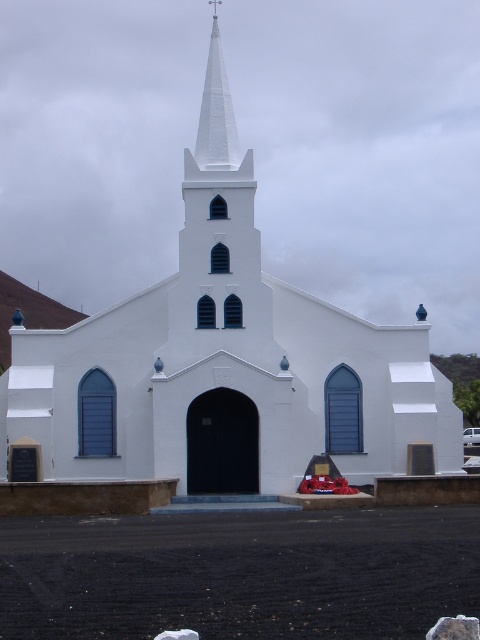
You are standing in front of the church and see a point marked at coordinates (455,628). What object is located at that point?

The point at coordinates (455,628) marks a smooth gray rock at lower right.

You are a photographer standing in front of the church. You want to take a photo of the white matte van at center without the white smooth steeple at upper center appearing in the frame. Is this possible given their positions?

The white smooth steeple at upper center is positioned over the white matte van at center, so it would block the view of the van. Therefore, it is not possible to take a photo of the white matte van at center without the steeple appearing in the frame.

You are standing in front of the white church with the steeple. You notice two points marked on the church facade. The first point is at coordinate point [230,109], and the second is at point [472,428]. Which of these points is closer to you?

Point [230,109] is closer to the viewer than point [472,428].